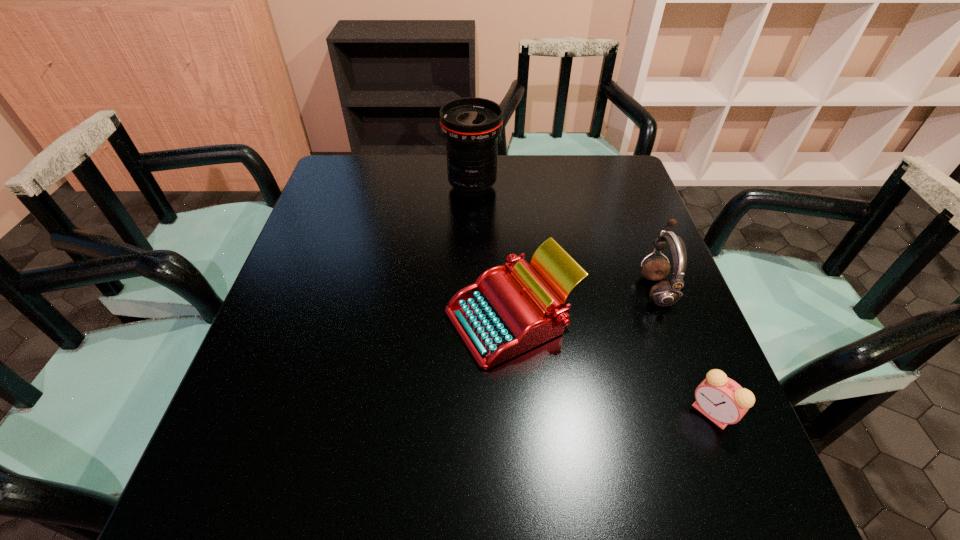
The image size is (960, 540). Identify the location of the farthest object. 471,126.

Where is `the tallest object`? This screenshot has height=540, width=960. the tallest object is located at coordinates (471, 126).

Find the location of a particular element. Image resolution: width=960 pixels, height=540 pixels. the second tallest object is located at coordinates (665, 293).

Identify the location of the third tallest object. (504, 313).

At what (x,y) coordinates should I click in order to perform the action: click on alarm clock. Please return your answer as a coordinate pair (x, y). The width and height of the screenshot is (960, 540). Looking at the image, I should click on (721, 399).

Locate an element on the screen. This screenshot has width=960, height=540. the nearest object is located at coordinates (721, 399).

Identify the location of free space located 0.300m on the right of the telephoto lens. This screenshot has width=960, height=540. (600, 186).

At what (x,y) coordinates should I click in order to perform the action: click on free region located 0.210m on the ear pads of the second tallest object. Please return your answer as a coordinate pair (x, y). The image size is (960, 540). Looking at the image, I should click on 551,289.

Image resolution: width=960 pixels, height=540 pixels. What are the coordinates of `blank space located on the ear pads of the second tallest object` in the screenshot? It's located at (603, 289).

Identify the location of vacant space located on the ear pads of the second tallest object. (517, 289).